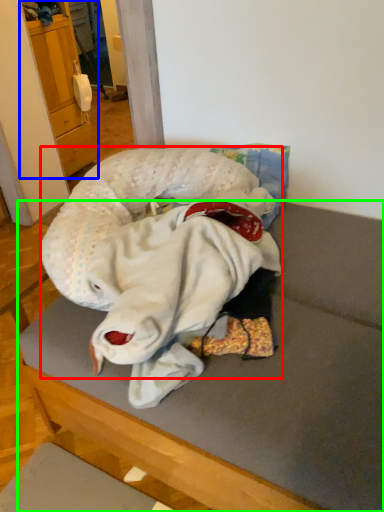
Question: Considering the real-world distances, which object is farthest from baby (highlighted by a red box)? cabinetry (highlighted by a blue box) or furniture (highlighted by a green box)?

Choices:
 (A) cabinetry
 (B) furniture

Answer: (A)